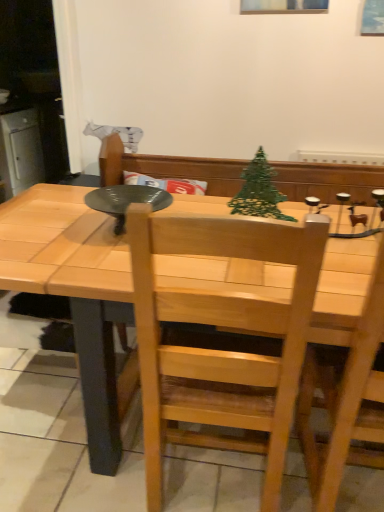
Question: Is green wire christmas tree at center outside of natural wood table at center?

Choices:
 (A) no
 (B) yes

Answer: (B)

Question: From the image's perspective, is green wire christmas tree at center under natural wood table at center?

Choices:
 (A) no
 (B) yes

Answer: (A)

Question: Is green wire christmas tree at center wider than natural wood table at center?

Choices:
 (A) no
 (B) yes

Answer: (A)

Question: Can you confirm if green wire christmas tree at center is smaller than natural wood table at center?

Choices:
 (A) no
 (B) yes

Answer: (B)

Question: Is green wire christmas tree at center shorter than natural wood table at center?

Choices:
 (A) no
 (B) yes

Answer: (B)

Question: From the image's perspective, is natural wood chair at center above or below green wire christmas tree at center?

Choices:
 (A) below
 (B) above

Answer: (A)

Question: Considering the positions of point tap(165, 423) and point tap(276, 194), is point tap(165, 423) closer or farther from the camera than point tap(276, 194)?

Choices:
 (A) farther
 (B) closer

Answer: (A)

Question: Considering the positions of natural wood chair at center and green wire christmas tree at center in the image, is natural wood chair at center taller or shorter than green wire christmas tree at center?

Choices:
 (A) tall
 (B) short

Answer: (A)

Question: Relative to green wire christmas tree at center, is natural wood chair at center in front or behind?

Choices:
 (A) behind
 (B) front

Answer: (B)

Question: From the image's perspective, is green wire christmas tree at center located above or below natural wood table at center?

Choices:
 (A) above
 (B) below

Answer: (A)

Question: Considering the positions of green wire christmas tree at center and natural wood table at center in the image, is green wire christmas tree at center bigger or smaller than natural wood table at center?

Choices:
 (A) big
 (B) small

Answer: (B)

Question: In terms of width, does green wire christmas tree at center look wider or thinner when compared to natural wood table at center?

Choices:
 (A) thin
 (B) wide

Answer: (A)

Question: From a real-world perspective, is green wire christmas tree at center physically located above or below natural wood table at center?

Choices:
 (A) below
 (B) above

Answer: (B)

Question: In the image, is natural wood table at center on the left side or the right side of natural wood chair at center?

Choices:
 (A) right
 (B) left

Answer: (B)

Question: Is natural wood table at center inside the boundaries of natural wood chair at center, or outside?

Choices:
 (A) inside
 (B) outside

Answer: (B)